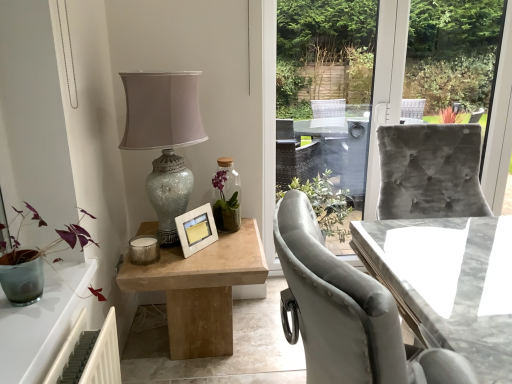
In order to click on white matte picture frame at center in this screenshot , I will do `click(196, 229)`.

In order to face crackle glass lampshade at upper left, should I rotate leftwards or rightwards?

Turn left by 13.001 degrees to look at crackle glass lampshade at upper left.

Describe the element at coordinates (164, 137) in the screenshot. This screenshot has height=384, width=512. I see `crackle glass lampshade at upper left` at that location.

The height and width of the screenshot is (384, 512). I want to click on velvet grey chair at right, so click(x=386, y=87).

At what (x,y) coordinates should I click in order to perform the action: click on natural wood table at center, arranged as the 1th table when viewed from the left. Please return your answer as a coordinate pair (x, y). Image resolution: width=512 pixels, height=384 pixels. Looking at the image, I should click on (201, 289).

Locate an element on the screen. The image size is (512, 384). marble table at right, which ranks as the 1th table in right-to-left order is located at coordinates (449, 283).

Describe the element at coordinates (449, 283) in the screenshot. I see `marble table at right, which ranks as the 1th table in right-to-left order` at that location.

The image size is (512, 384). What do you see at coordinates (45, 246) in the screenshot?
I see `purple matte plant at left` at bounding box center [45, 246].

Identify the location of white matte picture frame at center. This screenshot has height=384, width=512. (196, 229).

Is marble table at right, which ranks as the 1th table in right-to-left order, positioned far away from velvet grey chair at right?

That's right, there is a large distance between marble table at right, which ranks as the 1th table in right-to-left order, and velvet grey chair at right.

Based on the photo, how different are the orientations of marble table at right, which ranks as the 1th table in right-to-left order, and velvet grey chair at right in degrees?

0.00228 degrees separate the facing orientations of marble table at right, which ranks as the 1th table in right-to-left order, and velvet grey chair at right.

Does marble table at right, which ranks as the 1th table in right-to-left order, come behind velvet grey chair at right?

No, it is in front of velvet grey chair at right.

Which is closer, (82, 232) or (227, 253)?

Point (82, 232) appears to be closer to the viewer than point (227, 253).

Which object is positioned more to the left, purple matte plant at left or natural wood table at center, arranged as the 1th table when viewed from the left?

purple matte plant at left is more to the left.

The width and height of the screenshot is (512, 384). Find the location of `houseplant above the natural wood table at center, arranged as the 1th table when viewed from the left (from a real-world perspective)`. houseplant above the natural wood table at center, arranged as the 1th table when viewed from the left (from a real-world perspective) is located at coordinates (45, 246).

From the picture: Measure the distance from marble table at right, which ranks as the second table in left-to-right order, to natural wood table at center, positioned as the 2th table in right-to-left order.

marble table at right, which ranks as the second table in left-to-right order, and natural wood table at center, positioned as the 2th table in right-to-left order, are 76.15 centimeters apart.

Locate an element on the screen. This screenshot has width=512, height=384. table in front of the natural wood table at center, arranged as the 1th table when viewed from the left is located at coordinates (449, 283).

Between marble table at right, which ranks as the 1th table in right-to-left order, and natural wood table at center, arranged as the 1th table when viewed from the left, which one is positioned in front?

Positioned in front is marble table at right, which ranks as the 1th table in right-to-left order.

Is marble table at right, which ranks as the 1th table in right-to-left order, positioned far away from natural wood table at center, arranged as the 1th table when viewed from the left?

They are positioned close to each other.

Considering the sizes of objects marble table at right, which ranks as the 1th table in right-to-left order, and purple matte plant at left in the image provided, who is bigger, marble table at right, which ranks as the 1th table in right-to-left order, or purple matte plant at left?

With larger size is marble table at right, which ranks as the 1th table in right-to-left order.

Is purple matte plant at left inside marble table at right, which ranks as the 1th table in right-to-left order?

No, purple matte plant at left is not inside marble table at right, which ranks as the 1th table in right-to-left order.

Locate an element on the screen. The width and height of the screenshot is (512, 384). the 1st table below the purple matte plant at left (from the image's perspective) is located at coordinates (449, 283).

From the image's perspective, is marble table at right, which ranks as the 1th table in right-to-left order, on purple matte plant at left?

No, from the image's perspective, marble table at right, which ranks as the 1th table in right-to-left order, is not on top of purple matte plant at left.

Can you see white matte picture frame at center touching natural wood table at center, arranged as the 1th table when viewed from the left?

No.

Between white matte picture frame at center and natural wood table at center, positioned as the 2th table in right-to-left order, which one has larger width?

natural wood table at center, positioned as the 2th table in right-to-left order.

Locate an element on the screen. This screenshot has height=384, width=512. the 1st table in front when counting from the white matte picture frame at center is located at coordinates (201, 289).

Between white matte picture frame at center and natural wood table at center, positioned as the 2th table in right-to-left order, which one appears on the right side from the viewer's perspective?

white matte picture frame at center.

From the image's perspective, is natural wood table at center, arranged as the 1th table when viewed from the left, on crackle glass lampshade at upper left?

No, from the image's perspective, natural wood table at center, arranged as the 1th table when viewed from the left, is not over crackle glass lampshade at upper left.

Is natural wood table at center, positioned as the 2th table in right-to-left order, beside crackle glass lampshade at upper left?

No, natural wood table at center, positioned as the 2th table in right-to-left order, is not beside crackle glass lampshade at upper left.

From their relative heights in the image, would you say natural wood table at center, arranged as the 1th table when viewed from the left, is taller or shorter than crackle glass lampshade at upper left?

natural wood table at center, arranged as the 1th table when viewed from the left, is shorter than crackle glass lampshade at upper left.

Looking at their sizes, would you say purple matte plant at left is wider or thinner than velvet grey chair at right?

Clearly, purple matte plant at left has more width compared to velvet grey chair at right.

Is purple matte plant at left oriented away from velvet grey chair at right?

No, purple matte plant at left is not facing away from velvet grey chair at right.

Does purple matte plant at left have a greater height compared to velvet grey chair at right?

In fact, purple matte plant at left may be shorter than velvet grey chair at right.

Which point is more distant from viewer, (x=52, y=252) or (x=402, y=36)?

The point (x=402, y=36) is more distant.

This screenshot has width=512, height=384. In order to click on window screen lying behind the marble table at right, which ranks as the second table in left-to-right order in this screenshot , I will do (386, 87).

Locate an element on the screen. The width and height of the screenshot is (512, 384). houseplant in front of the natural wood table at center, positioned as the 2th table in right-to-left order is located at coordinates (45, 246).

From the image, which object appears to be farther from velvet grey chair at right, purple matte plant at left or white matte picture frame at center?

purple matte plant at left lies further to velvet grey chair at right than the other object.

When comparing their distances from purple matte plant at left, does crackle glass lampshade at upper left or white matte picture frame at center seem closer?

The object closer to purple matte plant at left is crackle glass lampshade at upper left.

Which object lies further to the anchor point purple matte plant at left, velvet grey chair at right or marble table at right, which ranks as the 1th table in right-to-left order?

velvet grey chair at right lies further to purple matte plant at left than the other object.

Based on their spatial positions, is natural wood table at center, positioned as the 2th table in right-to-left order, or purple matte plant at left further from velvet grey chair at right?

purple matte plant at left is positioned further to the anchor velvet grey chair at right.

Estimate the real-world distances between objects in this image. Which object is further from natural wood table at center, arranged as the 1th table when viewed from the left, white matte picture frame at center or purple matte plant at left?

purple matte plant at left is further to natural wood table at center, arranged as the 1th table when viewed from the left.

Estimate the real-world distances between objects in this image. Which object is further from marble table at right, which ranks as the second table in left-to-right order, purple matte plant at left or natural wood table at center, arranged as the 1th table when viewed from the left?

purple matte plant at left lies further to marble table at right, which ranks as the second table in left-to-right order, than the other object.

Considering their positions, is marble table at right, which ranks as the second table in left-to-right order, positioned further to white matte picture frame at center than crackle glass lampshade at upper left?

marble table at right, which ranks as the second table in left-to-right order.

When comparing their distances from white matte picture frame at center, does crackle glass lampshade at upper left or purple matte plant at left seem closer?

crackle glass lampshade at upper left is positioned closer to the anchor white matte picture frame at center.

Locate an element on the screen. The width and height of the screenshot is (512, 384). window screen between white matte picture frame at center and marble table at right, which ranks as the 1th table in right-to-left order, from left to right is located at coordinates (386, 87).

The height and width of the screenshot is (384, 512). What are the coordinates of `window screen between crackle glass lampshade at upper left and marble table at right, which ranks as the 1th table in right-to-left order` in the screenshot? It's located at (386, 87).

This screenshot has height=384, width=512. I want to click on picture frame located between crackle glass lampshade at upper left and marble table at right, which ranks as the 1th table in right-to-left order, in the left-right direction, so click(x=196, y=229).

This screenshot has height=384, width=512. I want to click on window screen between natural wood table at center, arranged as the 1th table when viewed from the left, and marble table at right, which ranks as the 1th table in right-to-left order, in the horizontal direction, so click(386, 87).